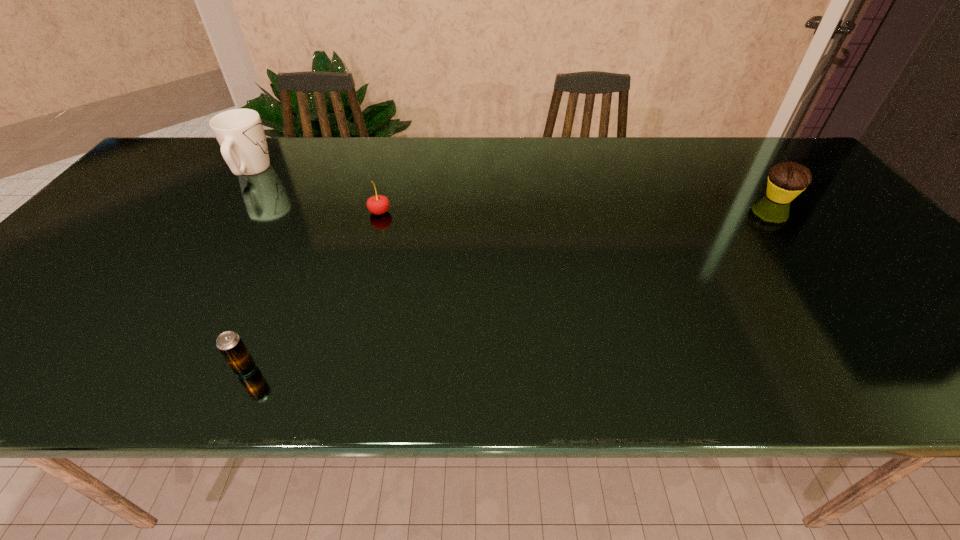
I want to click on mug, so click(x=240, y=133).

Where is `the tallest object`? The image size is (960, 540). the tallest object is located at coordinates (240, 133).

The image size is (960, 540). I want to click on cherry, so click(378, 204).

Identify the location of the rightmost object. tap(786, 180).

The height and width of the screenshot is (540, 960). What are the coordinates of `the nearest object` in the screenshot? It's located at (230, 345).

At what (x,y) coordinates should I click in order to perform the action: click on beer can. Please return your answer as a coordinate pair (x, y). Looking at the image, I should click on (230, 345).

Find the location of a particular element. free spot located 0.080m on the side of the tallest object with the handle is located at coordinates (270, 143).

This screenshot has width=960, height=540. Find the location of `blank space located on the side of the tallest object with the handle`. blank space located on the side of the tallest object with the handle is located at coordinates (268, 146).

The width and height of the screenshot is (960, 540). I want to click on free region located on the back of the cherry, so click(397, 144).

The width and height of the screenshot is (960, 540). Identify the location of free space located 0.100m on the front of the muffin. (807, 232).